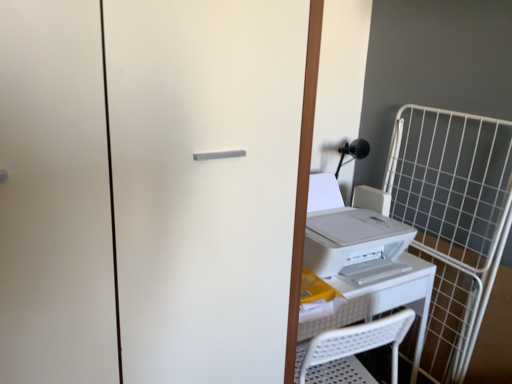
Question: Can you confirm if white plastic table at center is thinner than white plastic printer at right?

Choices:
 (A) yes
 (B) no

Answer: (B)

Question: Is the position of white plastic table at center more distant than that of white plastic printer at right?

Choices:
 (A) yes
 (B) no

Answer: (B)

Question: Could white plastic printer at right be considered to be inside white plastic table at center?

Choices:
 (A) no
 (B) yes

Answer: (A)

Question: Considering the relative sizes of white plastic table at center and white plastic printer at right in the image provided, is white plastic table at center wider than white plastic printer at right?

Choices:
 (A) yes
 (B) no

Answer: (A)

Question: Would you say white plastic table at center is outside white plastic printer at right?

Choices:
 (A) yes
 (B) no

Answer: (A)

Question: In terms of height, does white matte screen door at center look taller or shorter compared to white plastic table at center?

Choices:
 (A) tall
 (B) short

Answer: (A)

Question: Based on their sizes in the image, would you say white matte screen door at center is bigger or smaller than white plastic table at center?

Choices:
 (A) big
 (B) small

Answer: (A)

Question: From a real-world perspective, is white matte screen door at center physically located above or below white plastic table at center?

Choices:
 (A) below
 (B) above

Answer: (B)

Question: In terms of width, does white matte screen door at center look wider or thinner when compared to white plastic table at center?

Choices:
 (A) wide
 (B) thin

Answer: (A)

Question: Is white wire cage at right wider or thinner than white plastic printer at right?

Choices:
 (A) wide
 (B) thin

Answer: (B)

Question: From their relative heights in the image, would you say white wire cage at right is taller or shorter than white plastic printer at right?

Choices:
 (A) short
 (B) tall

Answer: (B)

Question: Considering their positions, is white wire cage at right located in front of or behind white plastic printer at right?

Choices:
 (A) front
 (B) behind

Answer: (B)

Question: In terms of size, does white wire cage at right appear bigger or smaller than white plastic printer at right?

Choices:
 (A) small
 (B) big

Answer: (A)

Question: In the image, is white plastic printer at right on the left side or the right side of white wire cage at right?

Choices:
 (A) right
 (B) left

Answer: (B)

Question: Is white plastic printer at right inside or outside of white wire cage at right?

Choices:
 (A) inside
 (B) outside

Answer: (B)